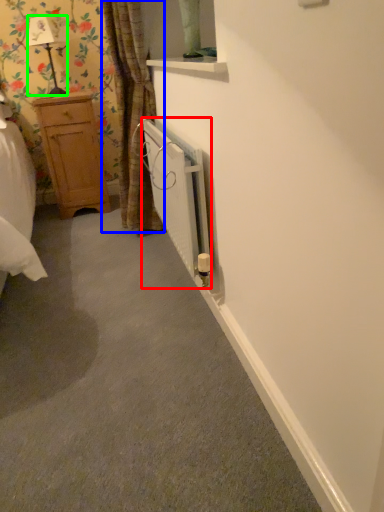
Question: Estimate the real-world distances between objects in this image. Which object is farther from radiator (highlighted by a red box), curtain (highlighted by a blue box) or lamp (highlighted by a green box)?

Choices:
 (A) curtain
 (B) lamp

Answer: (B)